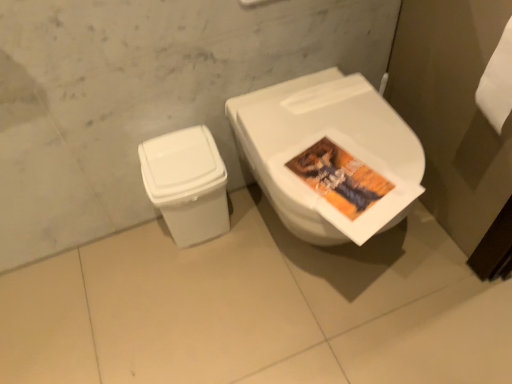
You are a GUI agent. You are given a task and a screenshot of the screen. Output one action in this format:
    pyautogui.click(x=<x>, y=<y>)
    Task: Click on the vacant area that is in front of white plastic trash can at lower left
    The width and height of the screenshot is (512, 384).
    Given the screenshot: What is the action you would take?
    pyautogui.click(x=200, y=280)